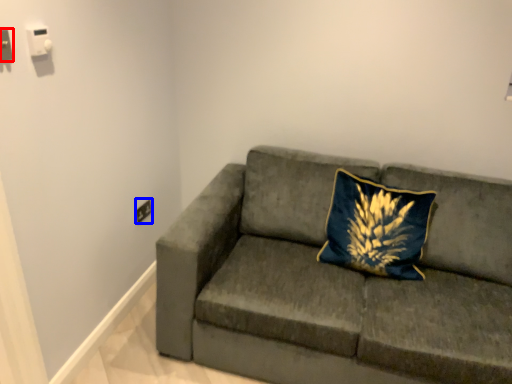
Question: Which object appears farthest to the camera in this image, electric outlet (highlighted by a red box) or electric outlet (highlighted by a blue box)?

Choices:
 (A) electric outlet
 (B) electric outlet

Answer: (B)